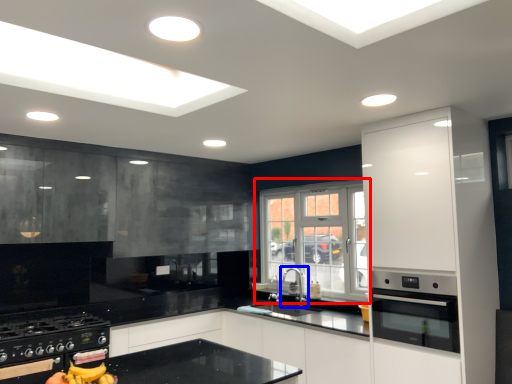
Question: Which object appears closest to the camera in this image, window (highlighted by a red box) or tap (highlighted by a blue box)?

Choices:
 (A) window
 (B) tap

Answer: (A)